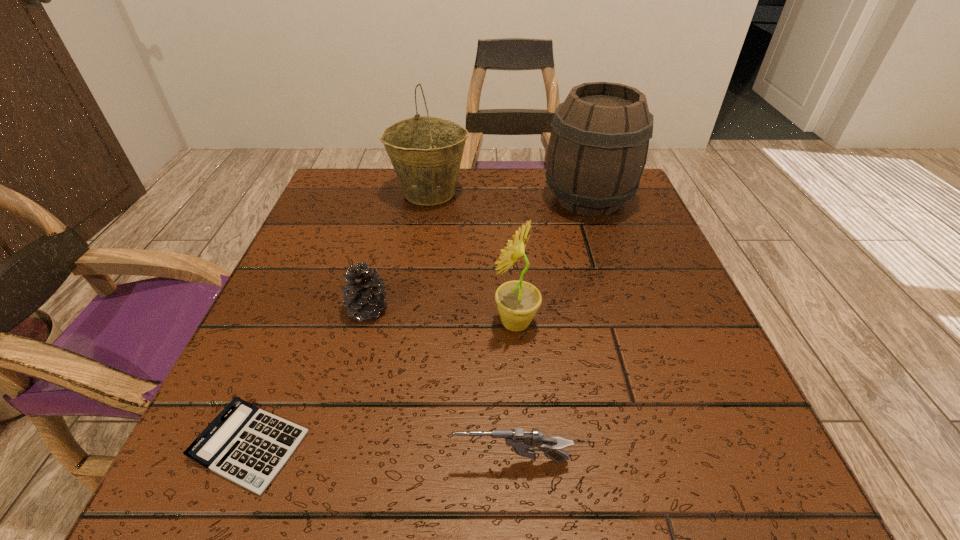
Locate an element on the screen. object that is at the right edge is located at coordinates (597, 151).

Image resolution: width=960 pixels, height=540 pixels. In order to click on object that is at the near left corner in this screenshot , I will do `click(248, 446)`.

Find the location of a particular element. The image size is (960, 540). object that is at the far right corner is located at coordinates (597, 151).

The width and height of the screenshot is (960, 540). In order to click on free space at the far edge in this screenshot , I will do `click(491, 214)`.

Where is `free space at the near edge of the desktop`? The image size is (960, 540). free space at the near edge of the desktop is located at coordinates (424, 456).

Where is `vacant region at the left edge`? vacant region at the left edge is located at coordinates (223, 389).

Find the location of a particular element. free point at the right edge is located at coordinates (660, 410).

Locate an element on the screen. vacant space at the far left corner of the desktop is located at coordinates (335, 168).

The width and height of the screenshot is (960, 540). What are the coordinates of `vacant space at the near left corner` in the screenshot? It's located at (300, 443).

I want to click on vacant space in between the right wine bucket and the pinecone, so click(478, 254).